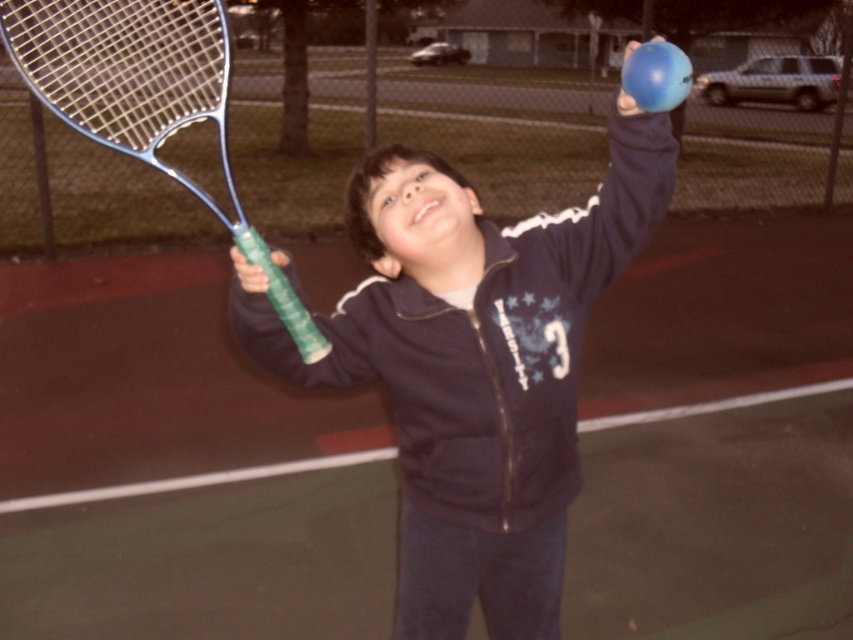
Question: Which object appears closest to the camera in this image?

Choices:
 (A) green rubber tennis court at center
 (B) matte blue ball at upper right
 (C) blue metallic tennis racket at left

Answer: (C)

Question: Which point is closer to the camera?

Choices:
 (A) (700, 308)
 (B) (625, 100)

Answer: (B)

Question: Can you confirm if matte blue ball at upper right is positioned below blue metallic tennis racket at left?

Choices:
 (A) no
 (B) yes

Answer: (B)

Question: Does matte blue ball at upper right appear under blue metallic tennis racket at left?

Choices:
 (A) no
 (B) yes

Answer: (B)

Question: Which object is farther from the camera taking this photo?

Choices:
 (A) green rubber tennis court at center
 (B) blue rubber ball at upper right

Answer: (A)

Question: Can you confirm if matte blue ball at upper right is wider than blue metallic tennis racket at left?

Choices:
 (A) no
 (B) yes

Answer: (A)